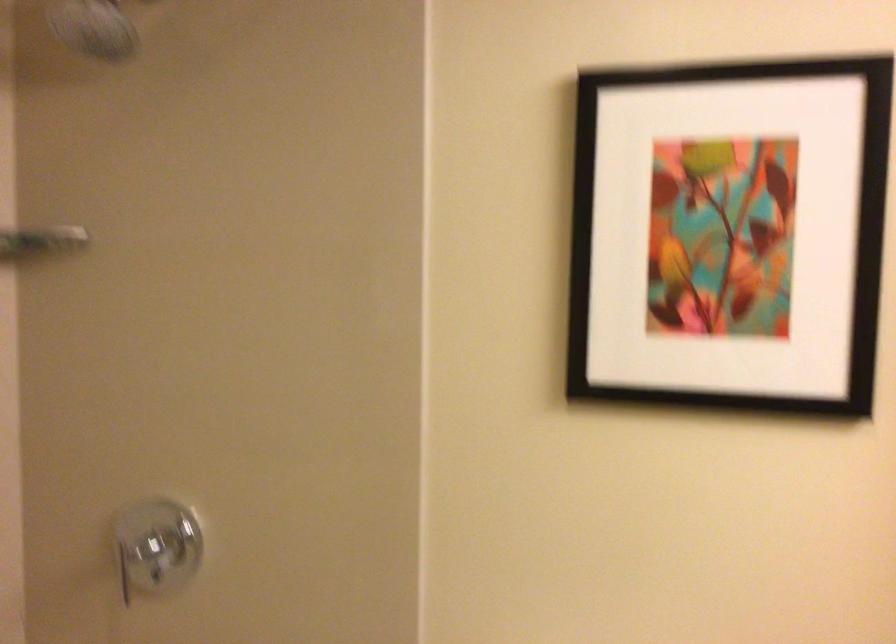
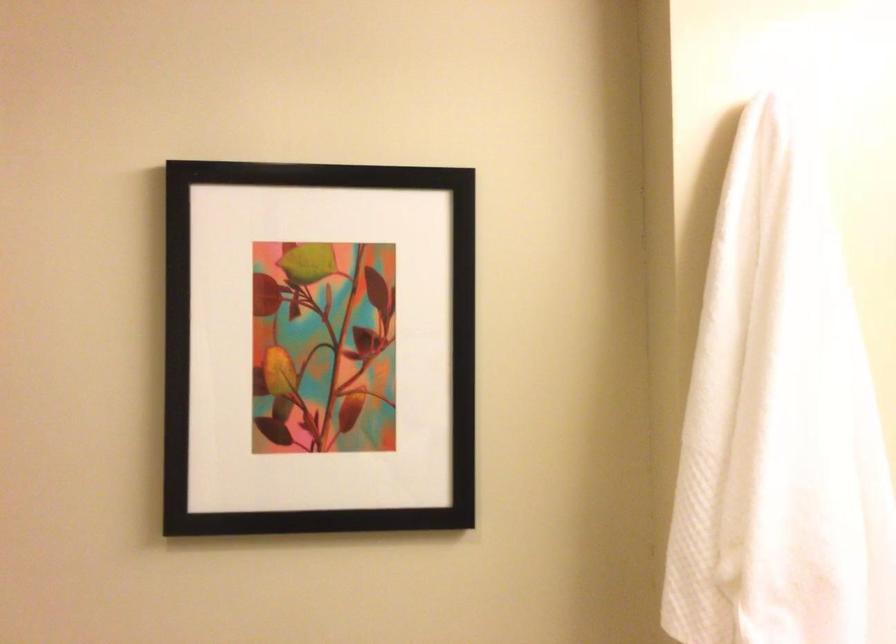
Question: The images are taken continuously from a first-person perspective. In which direction is your viewpoint rotating?

Choices:
 (A) Left
 (B) Right
 (C) Up
 (D) Down

Answer: (B)